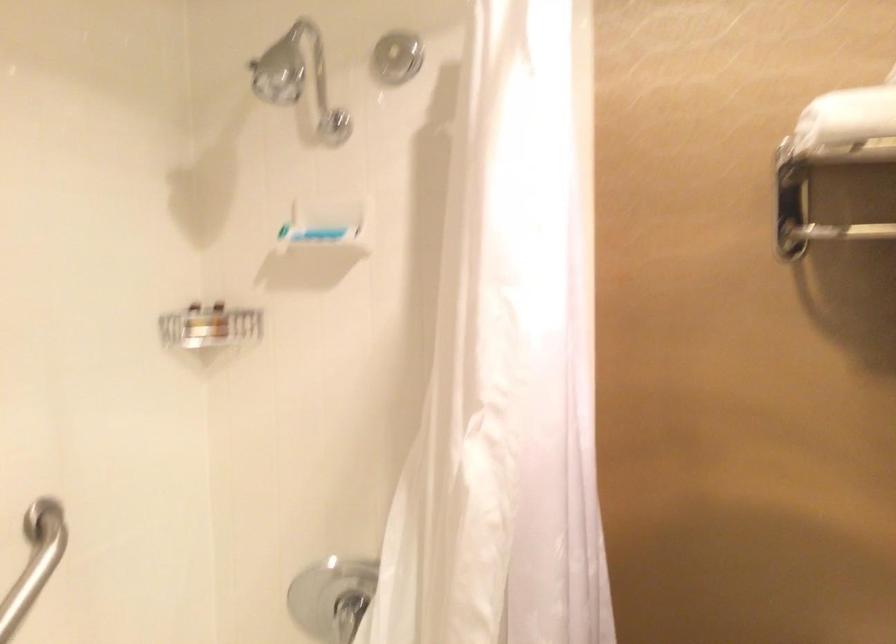
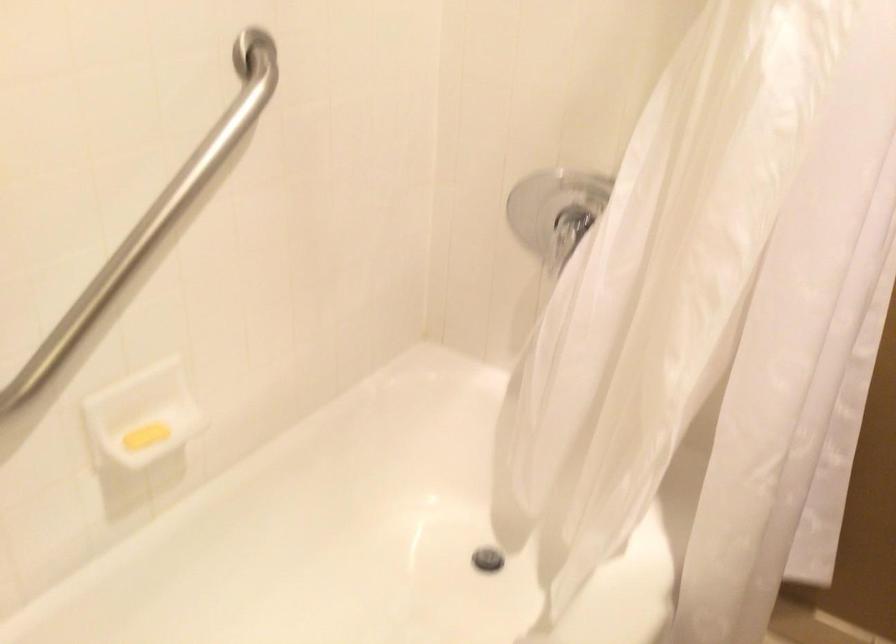
How did the camera likely rotate?

The camera's rotation is toward left-down.